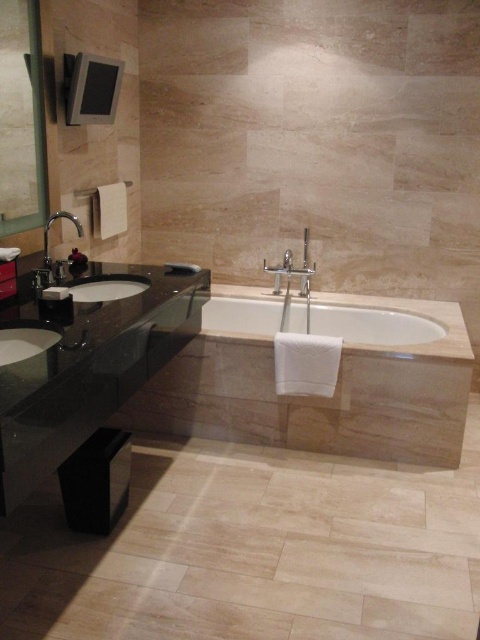
Question: Which point appears farthest from the camera in this image?

Choices:
 (A) (68, 218)
 (B) (216, 301)
 (C) (52, 339)

Answer: (B)

Question: Considering the relative positions of black granite vanity at lower left and white glossy sink at lower left in the image provided, where is black granite vanity at lower left located with respect to white glossy sink at lower left?

Choices:
 (A) left
 (B) right

Answer: (B)

Question: Among these objects, which one is nearest to the camera?

Choices:
 (A) satin nickel faucet at left
 (B) white glossy sink at lower left
 (C) white glossy sink at left
 (D) matte glass mirror at upper left

Answer: (B)

Question: Which point is closer to the camera taking this photo?

Choices:
 (A) (336, 324)
 (B) (72, 212)
 (C) (9, 28)
 (D) (56, 336)

Answer: (D)

Question: Can you confirm if black granite vanity at lower left is positioned to the right of matte glass mirror at upper left?

Choices:
 (A) yes
 (B) no

Answer: (A)

Question: Is white glossy sink at left below satin nickel faucet at left?

Choices:
 (A) no
 (B) yes

Answer: (B)